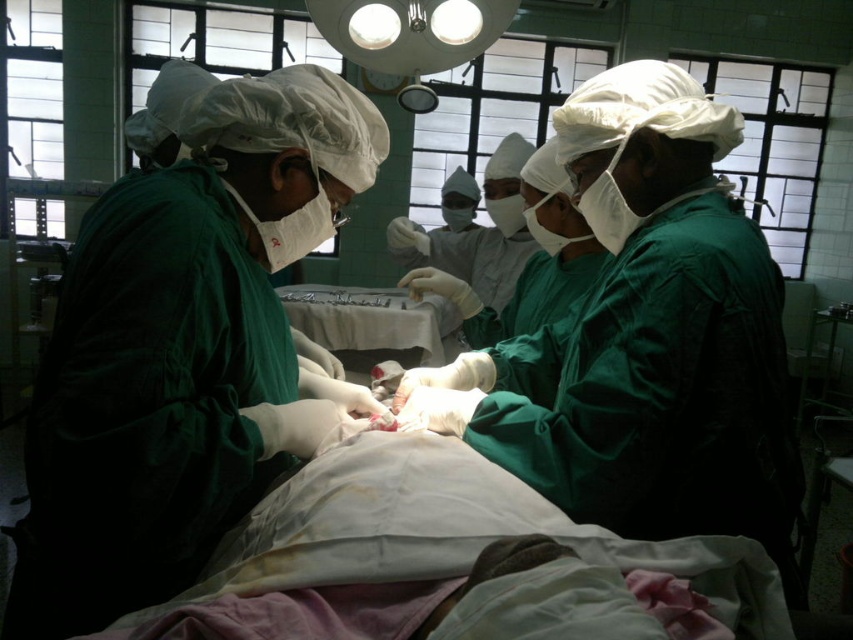
In the operating room scene, there is a green matte surgical gown at center and a satin white tray at center. From the perspective of someone standing at the head of the operating table, which object is positioned to the left?

The satin white tray at center is to the left of the green matte surgical gown at center, so from the perspective of someone standing at the head of the operating table, the satin white tray at center would be on the left side.

You are a medical student observing the surgery. You notice a point marked at coordinates (184, 352). Which object is this point located on?

The point at (184, 352) is located on the green matte surgical gown at center.

You are a surgical nurse preparing to place a medical tool on the surface near the green matte surgical gown at center and the satin white tray at center. Which object has a smaller width?

The green matte surgical gown at center has a smaller width than the satin white tray at center.